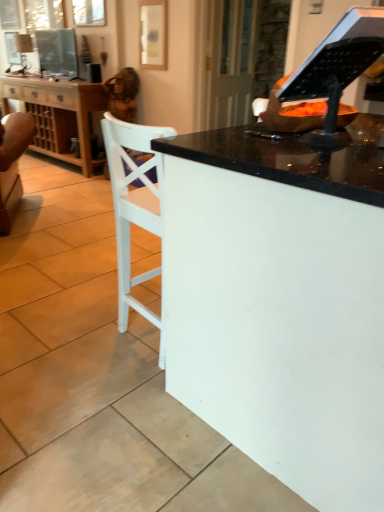
Question: Is white glossy desk at center turned away from black plastic music stand at upper right?

Choices:
 (A) yes
 (B) no

Answer: (B)

Question: Is white glossy desk at center not within black plastic music stand at upper right?

Choices:
 (A) yes
 (B) no

Answer: (A)

Question: Is white glossy desk at center not close to black plastic music stand at upper right?

Choices:
 (A) no
 (B) yes

Answer: (A)

Question: Does white glossy desk at center come in front of black plastic music stand at upper right?

Choices:
 (A) yes
 (B) no

Answer: (A)

Question: Considering the relative sizes of white glossy desk at center and black plastic music stand at upper right in the image provided, is white glossy desk at center wider than black plastic music stand at upper right?

Choices:
 (A) yes
 (B) no

Answer: (A)

Question: From the image's perspective, relative to black plastic music stand at upper right, is white glossy desk at center above or below?

Choices:
 (A) below
 (B) above

Answer: (A)

Question: Considering the positions of white glossy desk at center and black plastic music stand at upper right in the image, is white glossy desk at center taller or shorter than black plastic music stand at upper right?

Choices:
 (A) tall
 (B) short

Answer: (A)

Question: Is white glossy desk at center spatially inside black plastic music stand at upper right, or outside of it?

Choices:
 (A) outside
 (B) inside

Answer: (A)

Question: Does point pos(182,362) appear closer or farther from the camera than point pos(326,53)?

Choices:
 (A) closer
 (B) farther

Answer: (B)

Question: Looking at the image, does transparent glass door at upper center seem bigger or smaller compared to wooden cabinet at left?

Choices:
 (A) small
 (B) big

Answer: (A)

Question: From the image's perspective, is transparent glass door at upper center above or below wooden cabinet at left?

Choices:
 (A) above
 (B) below

Answer: (A)

Question: Considering the positions of point (223, 111) and point (59, 125), is point (223, 111) closer or farther from the camera than point (59, 125)?

Choices:
 (A) farther
 (B) closer

Answer: (B)

Question: In terms of height, does transparent glass door at upper center look taller or shorter compared to wooden cabinet at left?

Choices:
 (A) tall
 (B) short

Answer: (A)

Question: Considering the positions of matte wooden picture frame at upper center and white glossy desk at center in the image, is matte wooden picture frame at upper center taller or shorter than white glossy desk at center?

Choices:
 (A) short
 (B) tall

Answer: (A)

Question: In the image, is matte wooden picture frame at upper center positioned in front of or behind white glossy desk at center?

Choices:
 (A) front
 (B) behind

Answer: (B)